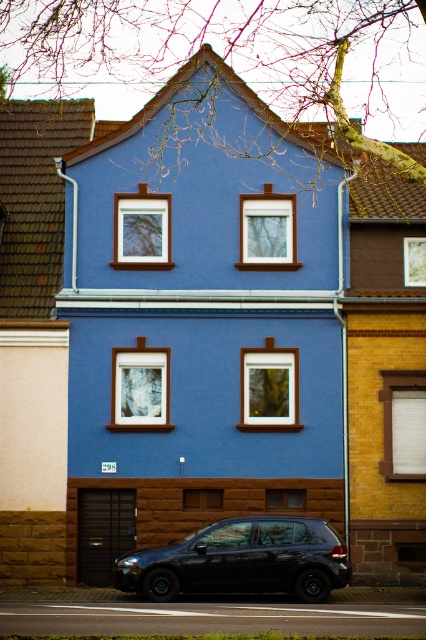
You are a delivery person trying to locate the entrance to the blue house. You see the brown wood trim at center and the black matte car at lower center. Based on their positions, which side of the car should you approach to find the entrance?

The brown wood trim at center is to the left of the black matte car at lower center. Since the entrance is likely near the brown wood trim, you should approach the left side of the car to find the entrance.

You are a delivery person approaching the blue house and need to locate the entrance. You see the brown wood trim at center and the black matte car at lower center. Which object is closer to the entrance of the blue house?

The brown wood trim at center is closer to the entrance of the blue house because it is above the black matte car at lower center, indicating it is part of the building structure near the entrance area.